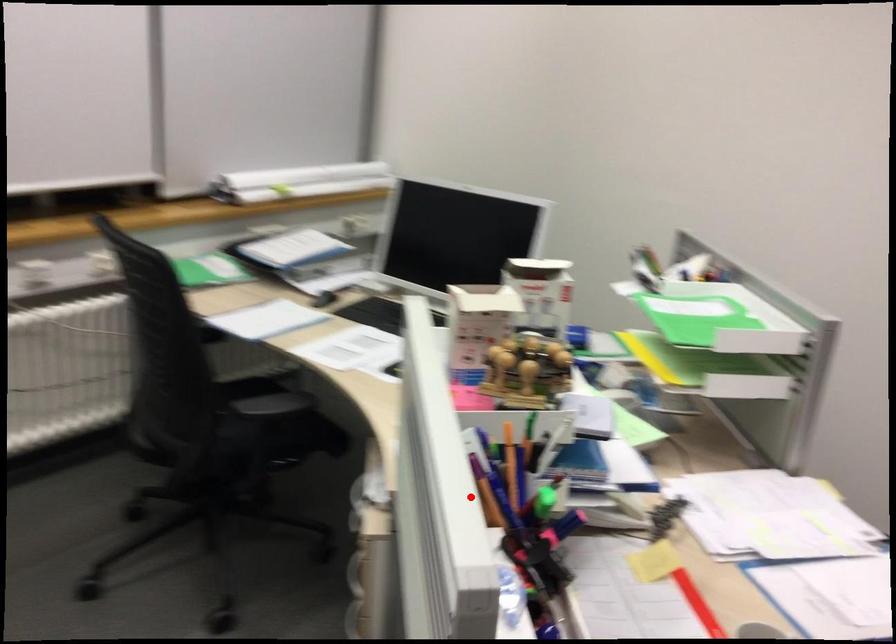
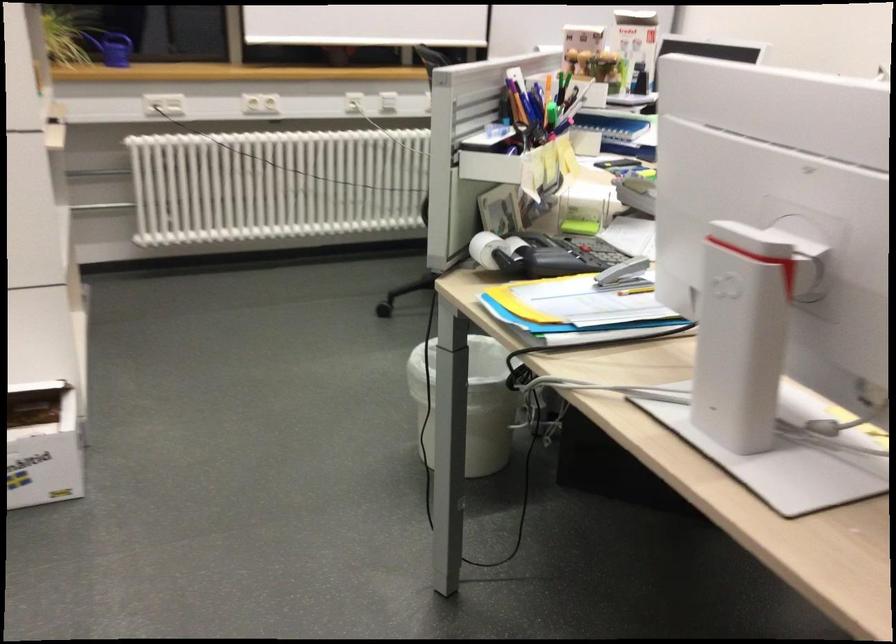
In the second image, find the point that corresponds to the highlighted location in the first image.

(521, 104)